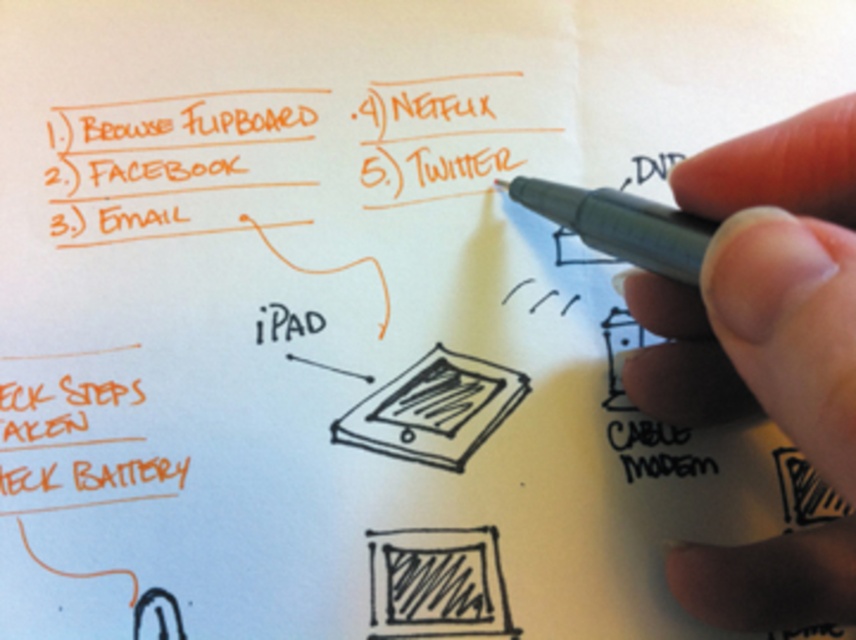
Describe the element at coordinates (764, 292) in the screenshot. I see `skinny pen at upper right` at that location.

Identify the location of skinny pen at upper right. (764, 292).

Image resolution: width=856 pixels, height=640 pixels. Find the location of `skinny pen at upper right`. skinny pen at upper right is located at coordinates (764, 292).

Is skinny pen at upper right smaller than black pen at upper right?

No.

Consider the image. Is skinny pen at upper right below black pen at upper right?

Indeed, skinny pen at upper right is positioned under black pen at upper right.

Is point (679, 324) more distant than point (637, 212)?

That is True.

The height and width of the screenshot is (640, 856). What are the coordinates of `skinny pen at upper right` in the screenshot? It's located at [764, 292].

At what (x,y) coordinates should I click in order to perform the action: click on sketchy paper tablet at center. Please return your answer as a coordinate pair (x, y). Looking at the image, I should click on (432, 410).

Can you confirm if sketchy paper tablet at center is shorter than black pen at upper right?

Yes, sketchy paper tablet at center is shorter than black pen at upper right.

What do you see at coordinates (432, 410) in the screenshot? I see `sketchy paper tablet at center` at bounding box center [432, 410].

This screenshot has width=856, height=640. I want to click on sketchy paper tablet at center, so click(x=432, y=410).